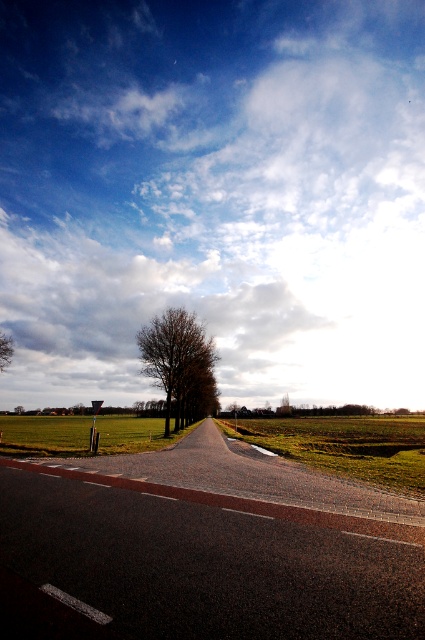
Is green grass field at lower left taller than bare branches at left?

Yes.

What do you see at coordinates (45, 435) in the screenshot? I see `green grass field at lower left` at bounding box center [45, 435].

This screenshot has height=640, width=425. Find the location of `green grass field at lower left`. green grass field at lower left is located at coordinates (45, 435).

Who is more forward, (241, 324) or (5, 342)?

Point (5, 342) is more forward.

Is cloudy sky at upper center to the left of bare branches at left from the viewer's perspective?

No, cloudy sky at upper center is not to the left of bare branches at left.

Between point (173, 298) and point (5, 346), which one is positioned in front?

Point (5, 346) is in front.

You are a GUI agent. You are given a task and a screenshot of the screen. Output one action in this format:
    pyautogui.click(x=<x>, y=<y>)
    Task: Click on the cloudy sky at upper center
    
    Given the screenshot: What is the action you would take?
    pyautogui.click(x=144, y=314)

Is bare branches at center below bare branches at left?

Yes.

Is point (187, 369) positioned behind point (11, 356)?

Yes, point (187, 369) is farther from viewer.

Identify the location of bare branches at center. tap(180, 364).